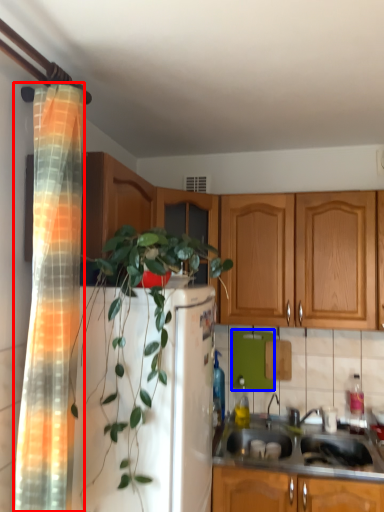
Question: Which point is further to the camera, shower curtain (highlighted by a red box) or appliance (highlighted by a blue box)?

Choices:
 (A) shower curtain
 (B) appliance

Answer: (B)